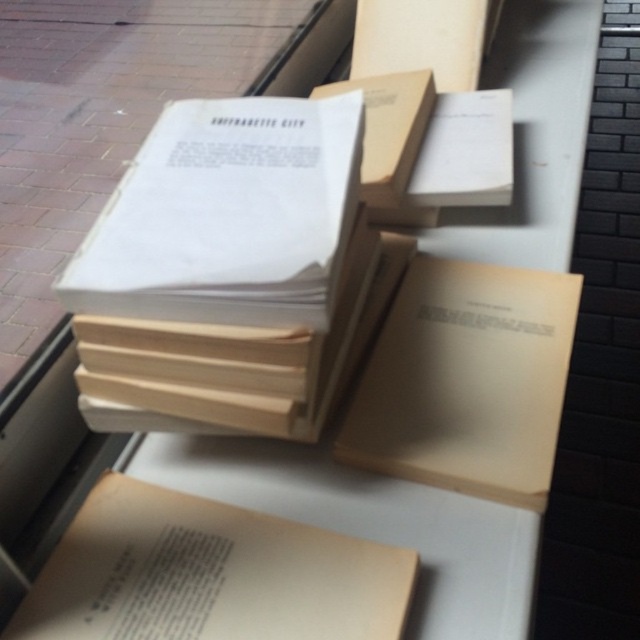
Question: Does white paper book at center have a greater width compared to beige matte book at center?

Choices:
 (A) no
 (B) yes

Answer: (A)

Question: Does white paper book at center have a larger size compared to beige cardboard box at center?

Choices:
 (A) no
 (B) yes

Answer: (B)

Question: Based on their relative distances, which object is farther from the beige matte book at center?

Choices:
 (A) beige paper book at lower left
 (B) beige cardboard box at center
 (C) matte cardboard box at upper center
 (D) white paper book at center

Answer: (C)

Question: Which point is farther to the camera?

Choices:
 (A) (362, 355)
 (B) (60, 616)
 (C) (442, 51)

Answer: (C)

Question: Among these objects, which one is nearest to the camera?

Choices:
 (A) matte cardboard box at upper center
 (B) white paper book at center

Answer: (B)

Question: Can you confirm if white paper book at center is thinner than beige paper book at lower left?

Choices:
 (A) no
 (B) yes

Answer: (B)